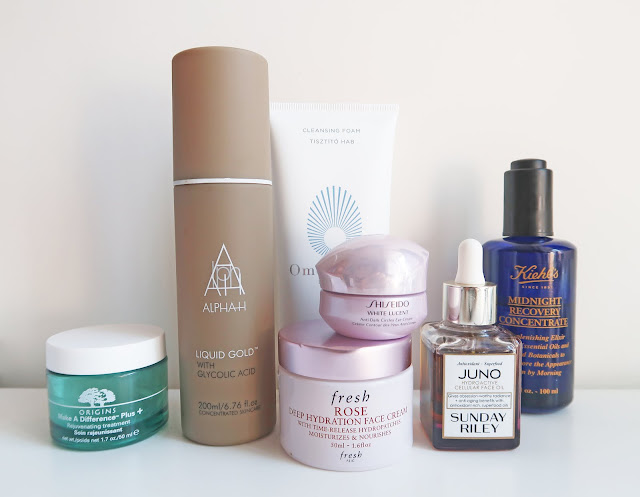
Where is `white counter top`? white counter top is located at coordinates (214, 468).